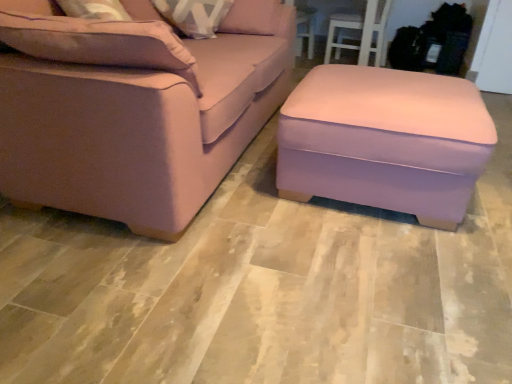
Question: Relative to matte pink fabric couch at center, is purple fabric ottoman at center in front or behind?

Choices:
 (A) front
 (B) behind

Answer: (B)

Question: In terms of size, does purple fabric ottoman at center appear bigger or smaller than matte pink fabric couch at center?

Choices:
 (A) small
 (B) big

Answer: (A)

Question: From a real-world perspective, is purple fabric ottoman at center positioned above or below matte pink fabric couch at center?

Choices:
 (A) below
 (B) above

Answer: (A)

Question: Based on their positions, is matte pink fabric couch at center located to the left or right of purple fabric ottoman at center?

Choices:
 (A) right
 (B) left

Answer: (B)

Question: From a real-world perspective, relative to purple fabric ottoman at center, is matte pink fabric couch at center vertically above or below?

Choices:
 (A) below
 (B) above

Answer: (B)

Question: From the image's perspective, relative to purple fabric ottoman at center, is matte pink fabric couch at center above or below?

Choices:
 (A) below
 (B) above

Answer: (B)

Question: In terms of size, does matte pink fabric couch at center appear bigger or smaller than purple fabric ottoman at center?

Choices:
 (A) small
 (B) big

Answer: (B)